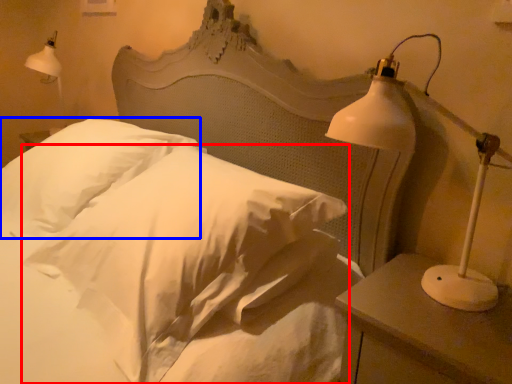
Question: Which object is closer to the camera taking this photo, pillow (highlighted by a red box) or pillow (highlighted by a blue box)?

Choices:
 (A) pillow
 (B) pillow

Answer: (A)